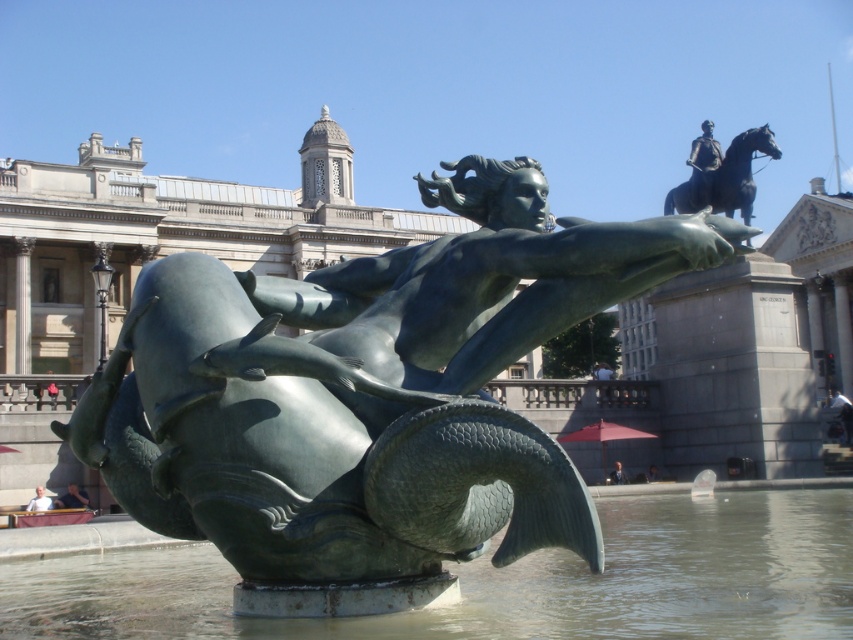
You are a tour guide explaining the layout of the plaza to visitors. You mention the greenish water at center and the polished bronze statue at upper right. How far apart are these two landmarks?

The greenish water at center and the polished bronze statue at upper right are 97.70 feet apart.

Based on the photo, you are an art student observing the fountain area. You need to determine which statue is bigger between the green polished bronze mermaid at center and the polished bronze statue at upper right. Which one is larger?

The green polished bronze mermaid at center has a larger size compared to the polished bronze statue at upper right, so the green polished bronze mermaid at center is bigger.

Looking at this image, you are standing in the public square and see the green polished bronze mermaid at center and the greenish water at center. Which object is located above the other?

The green polished bronze mermaid at center is positioned over greenish water at center, so the mermaid is above the water.